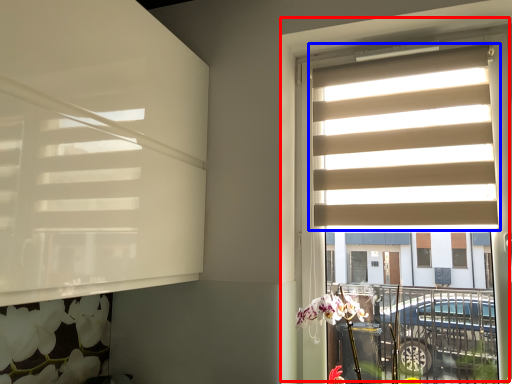
Question: Which point is closer to the camera, window (highlighted by a red box) or window blind (highlighted by a blue box)?

Choices:
 (A) window
 (B) window blind

Answer: (A)